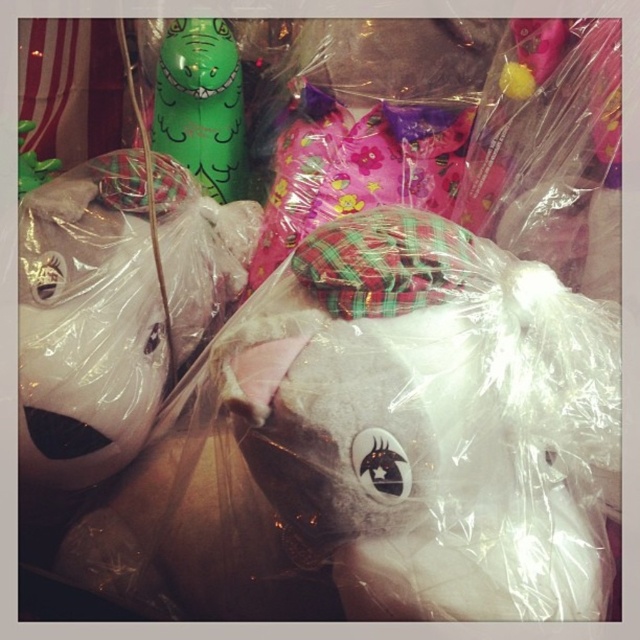
Who is more forward, (22,401) or (241,186)?

Positioned in front is point (22,401).

Is point (58, 371) farther from viewer compared to point (218, 156)?

No.

Is point (211, 205) farther from viewer compared to point (236, 92)?

No, it is in front of (236, 92).

Locate an element on the screen. This screenshot has height=640, width=640. white plush unicorn at lower left is located at coordinates (88, 323).